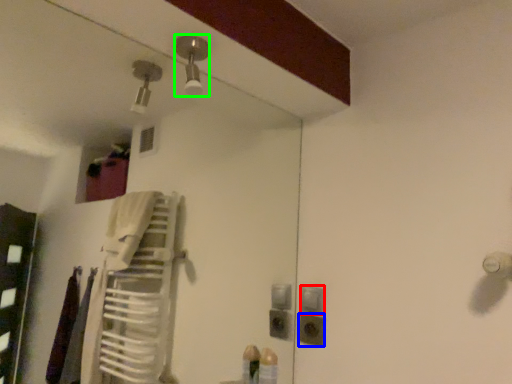
Question: Which is farther away from light switch (highlighted by a red box)? electric outlet (highlighted by a blue box) or light fixture (highlighted by a green box)?

Choices:
 (A) electric outlet
 (B) light fixture

Answer: (B)